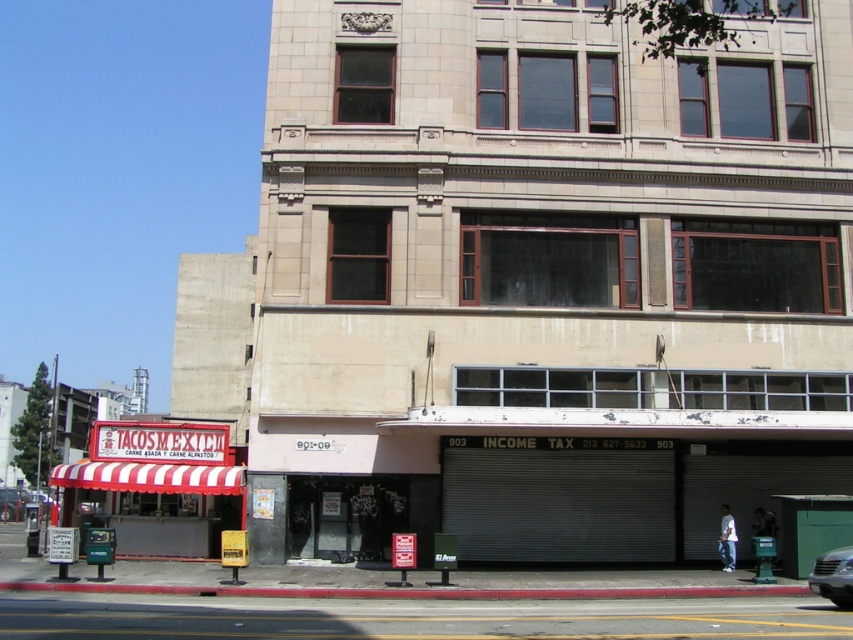
You are a customer standing in front of the silver metallic car at lower right. You want to walk to the red and white striped awning at lower left to buy a taco. Is the awning closer to you than the car you are next to?

The red and white striped awning at lower left is bigger than the silver metallic car at lower right, but size does not indicate distance. Since you are already standing next to the car, the awning is likely further away, but the description only provides size comparison, not distance. Therefore, we cannot determine the distance based on the given information.

You are a delivery person who needs to park your silver metallic car at lower right near the red and white striped awning at lower left. Can you park your car so that it fits entirely within the space next to the awning without overlapping it?

The red and white striped awning at lower left is wider than the silver metallic car at lower right. Therefore, there should be enough space to park the car next to the awning without overlapping it, as the awning is wider and can accommodate the car within the available space.

You are a delivery person standing at the red and white striped awning at lower left and need to deliver a package to the silver metallic car at lower right. The delivery robot you are using has a maximum range of 15 meters. Can the robot make the delivery without needing a recharge?

The distance between the red and white striped awning at lower left and the silver metallic car at lower right is 14.89 meters. Since the robot can travel up to 15 meters, it has enough range to make the delivery without needing a recharge.